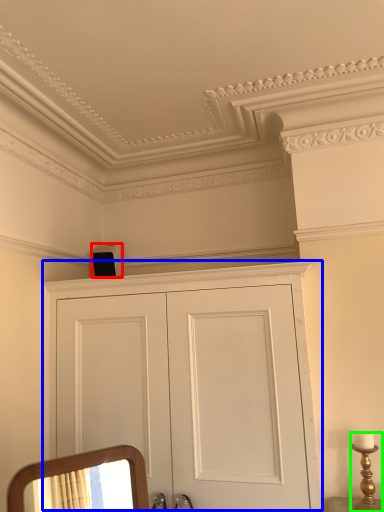
Question: Estimate the real-world distances between objects in this image. Which object is closer to speaker (highlighted by a red box), cupboard (highlighted by a blue box) or candle holder (highlighted by a green box)?

Choices:
 (A) cupboard
 (B) candle holder

Answer: (A)